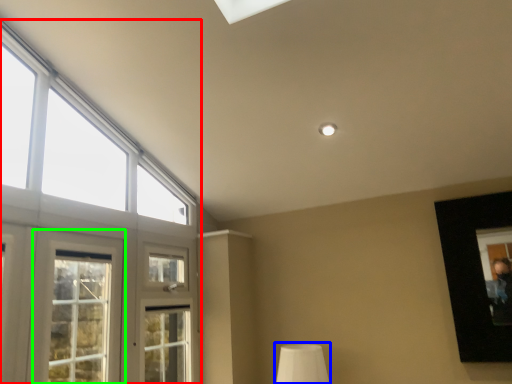
Question: Which is farther away from window (highlighted by a red box)? table lamp (highlighted by a blue box) or window (highlighted by a green box)?

Choices:
 (A) table lamp
 (B) window

Answer: (B)